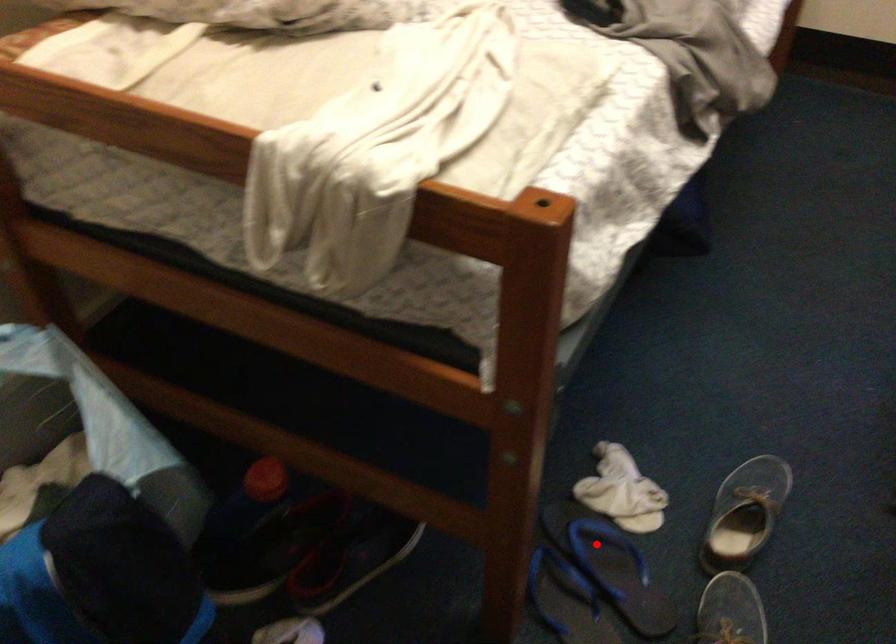
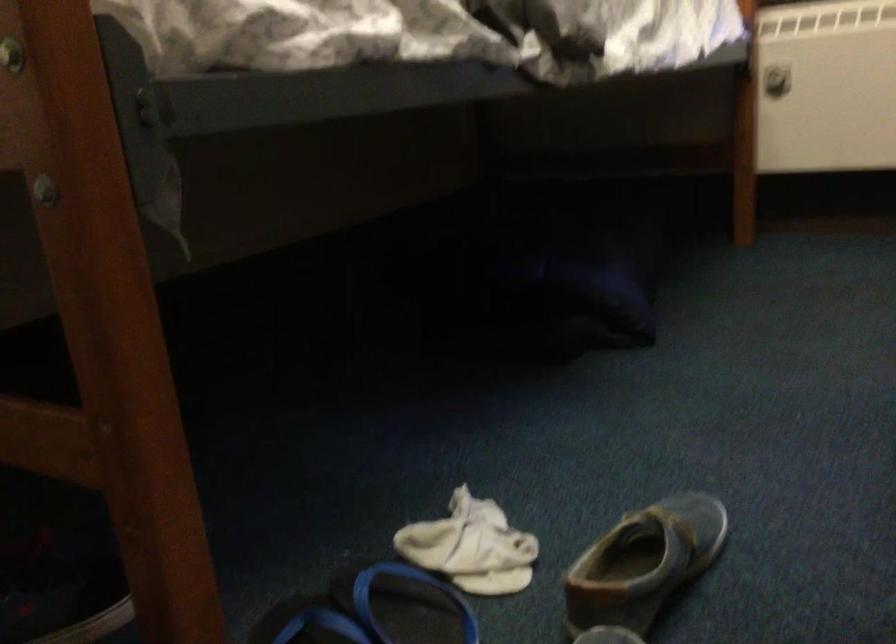
Question: I am providing you with two images of the same scene from different viewpoints. A red point is shown in image1. For the corresponding object point in image2, is it positioned nearer or farther from the camera?

Choices:
 (A) Nearer
 (B) Farther

Answer: (A)